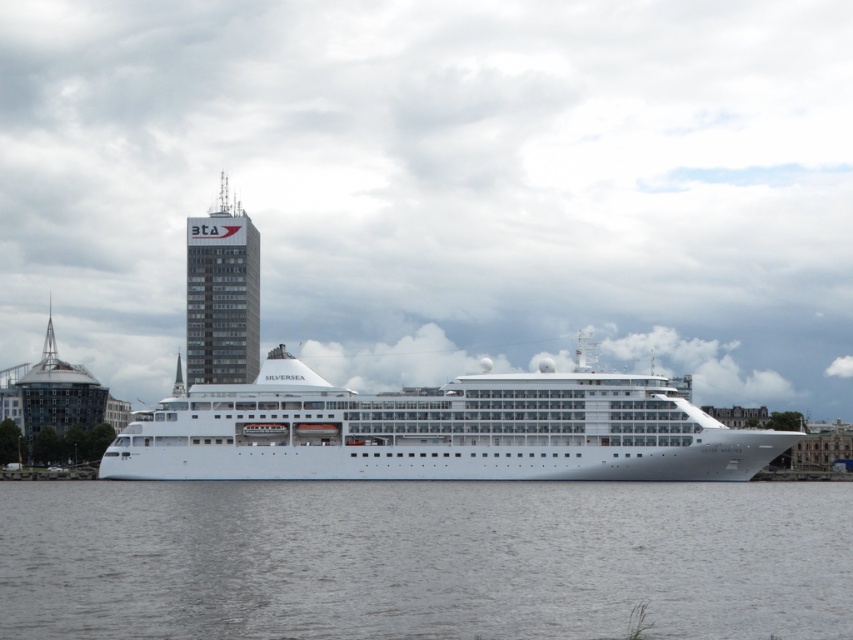
You are an observer standing on the dock and looking at the gray water at center and the white glossy cruise ship at center. Which one is wider from your perspective?

The white glossy cruise ship at center is wider than the gray water at center from your perspective.

You are standing on the dock and see the gray water at center and the white glossy cruise ship at center. Which object is positioned to the right side from your perspective?

The gray water at center is positioned to the right of the white glossy cruise ship at center.